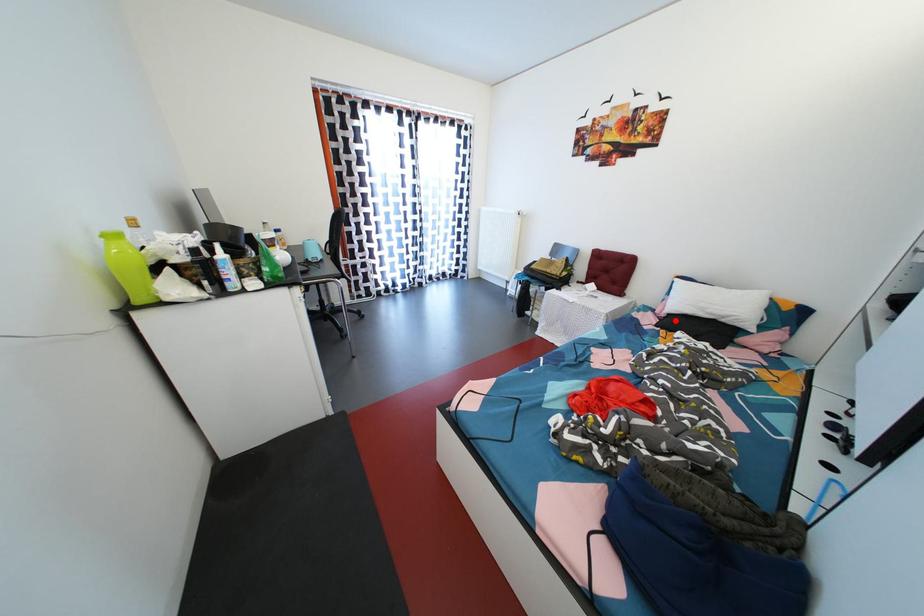
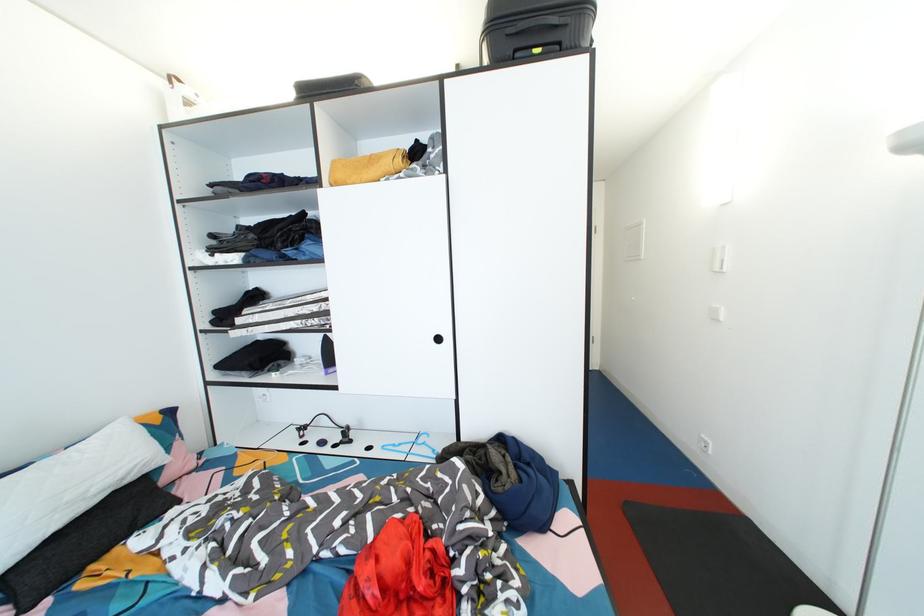
Where in the second image is the point corresponding to the highlighted location from the first image?

(8, 583)